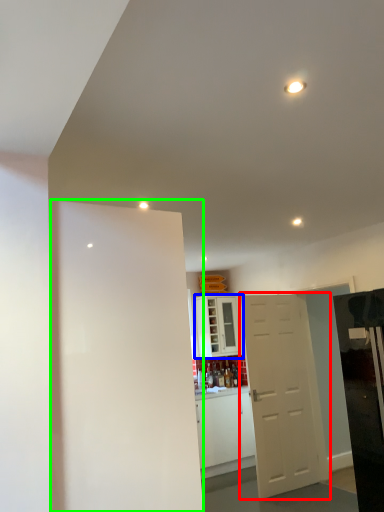
Question: Which object is the closest to the door (highlighted by a red box)? Choose among these: cabinetry (highlighted by a blue box) or door (highlighted by a green box).

Choices:
 (A) cabinetry
 (B) door

Answer: (A)